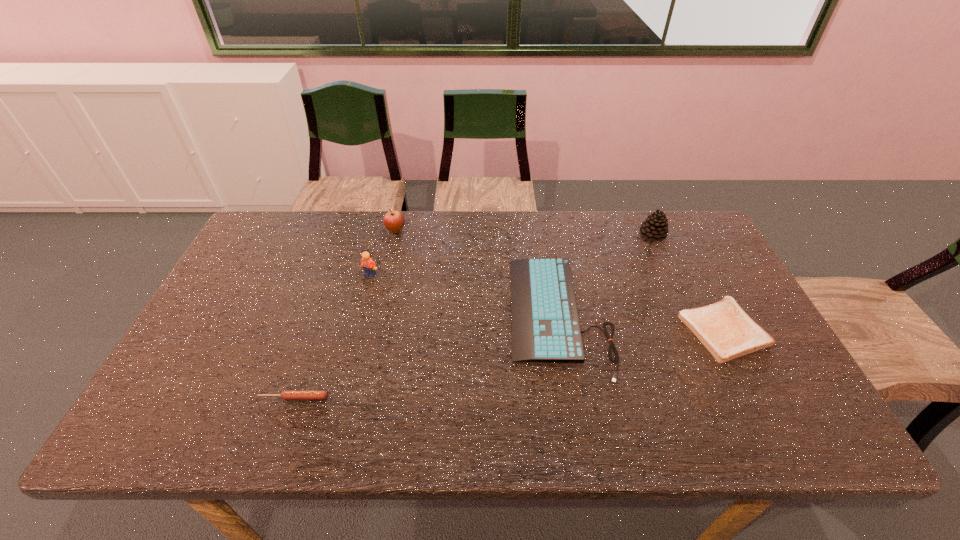
You are a GUI agent. You are given a task and a screenshot of the screen. Output one action in this format:
    pyautogui.click(x=<x>, y=<y>)
    Task: Click on the object that is at the far right corner
    
    Given the screenshot: What is the action you would take?
    pyautogui.click(x=655, y=227)

You are a GUI agent. You are given a task and a screenshot of the screen. Output one action in this format:
    pyautogui.click(x=<x>, y=<y>)
    Task: Click on the vacant space at the far edge
    
    Given the screenshot: What is the action you would take?
    pyautogui.click(x=573, y=211)

Image resolution: width=960 pixels, height=540 pixels. In the image, there is a desktop. Identify the location of free region at the near edge. (466, 410).

Locate an element on the screen. This screenshot has width=960, height=540. vacant space at the left edge of the desktop is located at coordinates (x=202, y=354).

Locate an element on the screen. This screenshot has height=540, width=960. free space at the right edge is located at coordinates click(791, 399).

At what (x,y) coordinates should I click in order to perform the action: click on vacant area at the far left corner of the desktop. Please return your answer as a coordinate pair (x, y). Looking at the image, I should click on (296, 248).

Locate an element on the screen. vacant region at the far right corner is located at coordinates (671, 248).

You are a GUI agent. You are given a task and a screenshot of the screen. Output one action in this format:
    pyautogui.click(x=<x>, y=<y>)
    Task: Click on the unoccupied area between the fourth object from left to right and the pinecone
    This screenshot has height=540, width=960.
    Given the screenshot: What is the action you would take?
    pyautogui.click(x=606, y=275)

At what (x,y) coordinates should I click in order to perform the action: click on empty space that is in between the apple and the sausage. Please return your answer as a coordinate pair (x, y). Looking at the image, I should click on (345, 314).

Locate an element on the screen. vacant area that lies between the Lego and the apple is located at coordinates (383, 253).